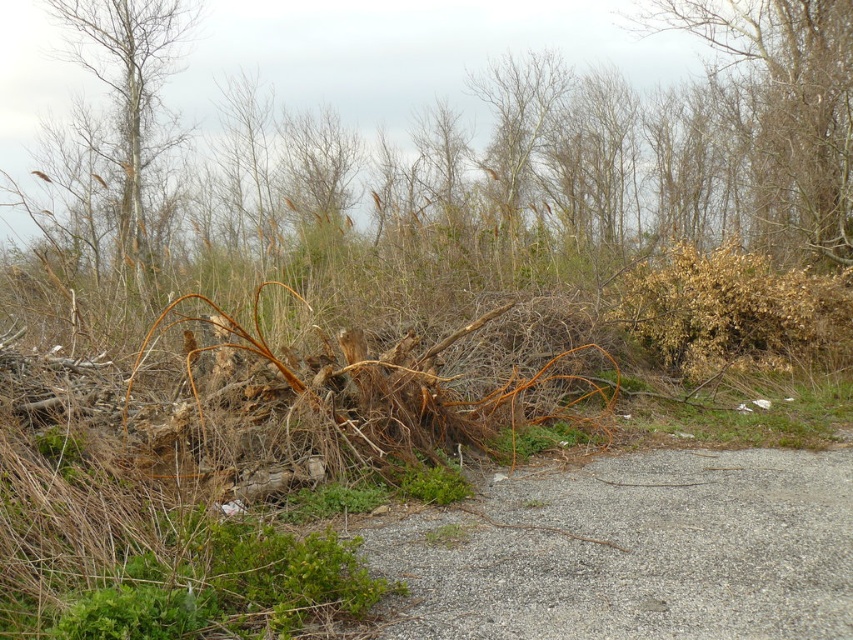
Which is in front, point (770, 74) or point (701, 282)?

Point (701, 282)

Is point (790, 115) behind point (675, 298)?

Yes.

Is point (761, 33) positioned before point (804, 300)?

No, (761, 33) is behind (804, 300).

The width and height of the screenshot is (853, 640). In order to click on brown dry branches at upper right in this screenshot , I will do `click(782, 112)`.

Which of these two, brown dry bush at right or bare wood tree at upper left, stands taller?

bare wood tree at upper left is taller.

Between point (714, 250) and point (125, 84), which one is positioned behind?

Positioned behind is point (125, 84).

You are a GUI agent. You are given a task and a screenshot of the screen. Output one action in this format:
    pyautogui.click(x=<x>, y=<y>)
    Task: Click on the brown dry bush at right
    This screenshot has height=640, width=853.
    Given the screenshot: What is the action you would take?
    coord(735,312)

Between point (782, 474) and point (94, 3), which one is positioned behind?

The point (94, 3) is more distant.

Who is lower down, gray gravel path at center or bare wood tree at upper left?

Positioned lower is gray gravel path at center.

Locate an element on the screen. The height and width of the screenshot is (640, 853). gray gravel path at center is located at coordinates (633, 550).